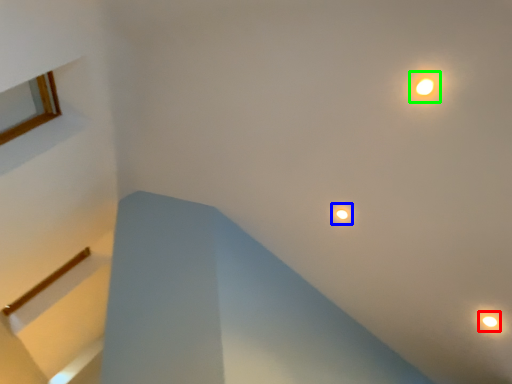
Question: Considering the real-world distances, which object is closest to droplight (highlighted by a red box)? droplight (highlighted by a blue box) or light (highlighted by a green box).

Choices:
 (A) droplight
 (B) light

Answer: (A)